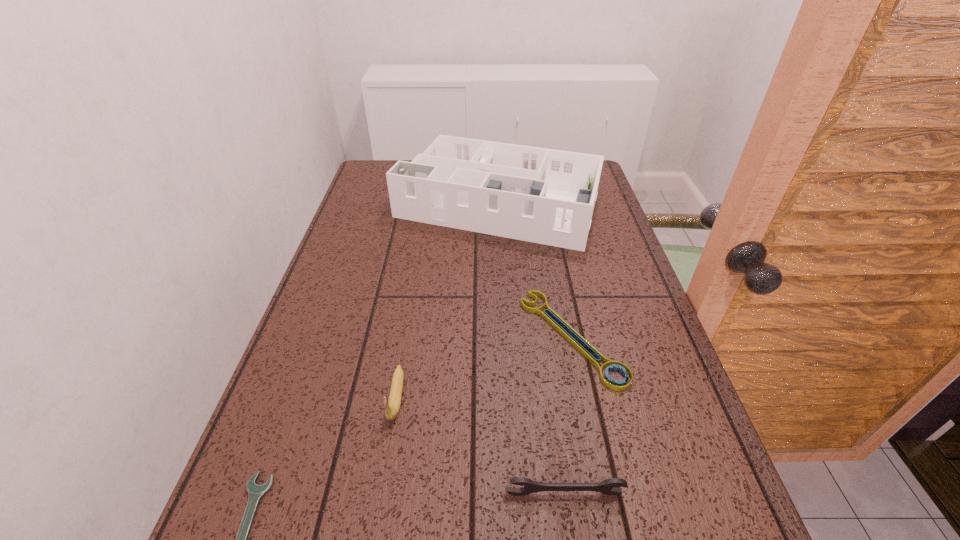
I want to click on the tallest object, so click(546, 196).

Locate an element on the screen. the farthest object is located at coordinates (546, 196).

Image resolution: width=960 pixels, height=540 pixels. Identify the location of banana. (392, 405).

Locate an element on the screen. This screenshot has height=540, width=960. the tallest wrench is located at coordinates (607, 486).

You are a GUI agent. You are given a task and a screenshot of the screen. Output one action in this format:
    pyautogui.click(x=<x>, y=<y>)
    Task: Click on the farthest wrench
    Image resolution: width=960 pixels, height=540 pixels.
    Given the screenshot: What is the action you would take?
    pyautogui.click(x=611, y=365)

The image size is (960, 540). What are the coordinates of `the second shortest wrench` in the screenshot? It's located at (611, 365).

This screenshot has height=540, width=960. Identify the location of vacant position located 0.090m at the stem of the banana. (384, 474).

Find the location of a particular element. This screenshot has width=960, height=540. vacant space situated 0.160m on the left of the second shortest object is located at coordinates (454, 338).

The height and width of the screenshot is (540, 960). What are the coordinates of `object that is at the far edge` in the screenshot? It's located at (546, 196).

At what (x,y) coordinates should I click in order to perform the action: click on object at the left edge. Please return your answer as a coordinate pair (x, y). This screenshot has height=540, width=960. Looking at the image, I should click on (546, 196).